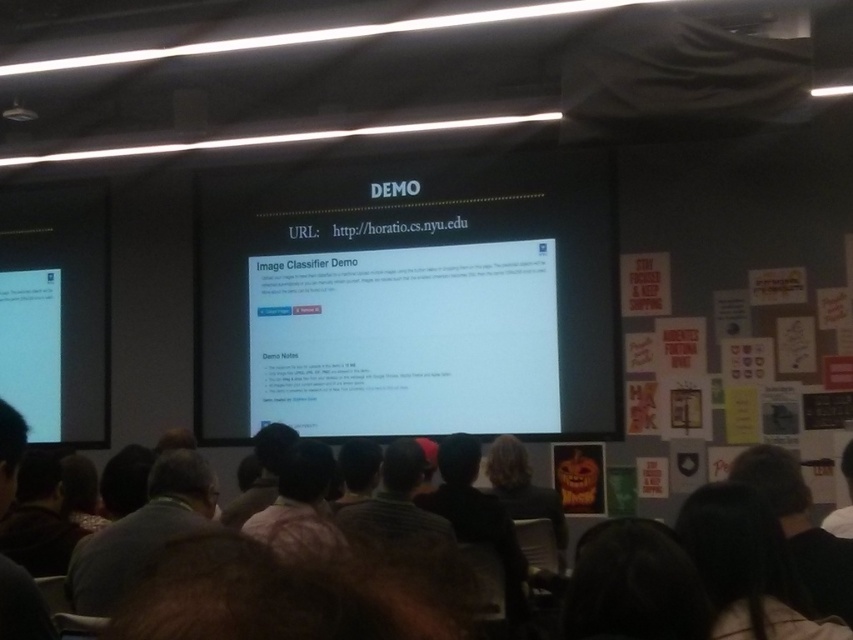
This screenshot has height=640, width=853. Describe the element at coordinates (633, 586) in the screenshot. I see `dark hair at lower right` at that location.

Can you confirm if dark hair at lower right is wider than black fur at center?

Incorrect, dark hair at lower right's width does not surpass black fur at center's.

Describe the element at coordinates (633, 586) in the screenshot. I see `dark hair at lower right` at that location.

At what (x,y) coordinates should I click in order to perform the action: click on dark hair at lower right. Please return your answer as a coordinate pair (x, y). This screenshot has width=853, height=640. Looking at the image, I should click on (633, 586).

Between point (425, 289) and point (598, 548), which one is positioned behind?

The point (425, 289) is behind.

What do you see at coordinates (409, 298) in the screenshot?
I see `white glossy projector screen at center` at bounding box center [409, 298].

This screenshot has height=640, width=853. In order to click on white glossy projector screen at center in this screenshot , I will do `click(409, 298)`.

The width and height of the screenshot is (853, 640). In order to click on white glossy projector screen at center in this screenshot , I will do `click(409, 298)`.

Can you confirm if dark brown hair at lower right is positioned below dark hair at lower right?

Incorrect, dark brown hair at lower right is not positioned below dark hair at lower right.

Does dark brown hair at lower right have a larger size compared to dark hair at lower right?

Indeed, dark brown hair at lower right has a larger size compared to dark hair at lower right.

Is point (726, 486) farther from camera compared to point (672, 550)?

Yes, it is behind point (672, 550).

Find the location of a particular element. The image size is (853, 640). dark brown hair at lower right is located at coordinates (747, 566).